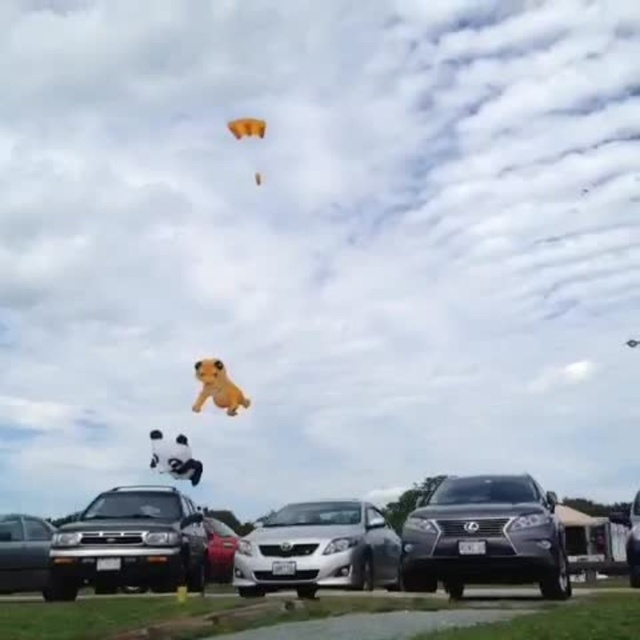
Question: Does matte black suv at center appear on the right side of yellow plush dog at center?

Choices:
 (A) yes
 (B) no

Answer: (A)

Question: Is matte black sedan at lower left behind yellow plush dog at center?

Choices:
 (A) no
 (B) yes

Answer: (A)

Question: Which object is positioned closest to the matte black suv at center?

Choices:
 (A) black plush bear at center
 (B) matte black suv at lower left
 (C) yellow plush dog at center
 (D) matte black sedan at lower left

Answer: (B)

Question: Which point is farther to the camera?

Choices:
 (A) (445, 556)
 (B) (179, 525)
 (C) (243, 132)

Answer: (C)

Question: In this image, where is black plush bear at center located relative to metallic silver sedan at center?

Choices:
 (A) below
 (B) above

Answer: (B)

Question: Which object is the closest to the silver metallic sedan at center?

Choices:
 (A) black plush bear at center
 (B) matte black suv at lower left
 (C) metallic silver sedan at center
 (D) matte black sedan at lower left

Answer: (B)